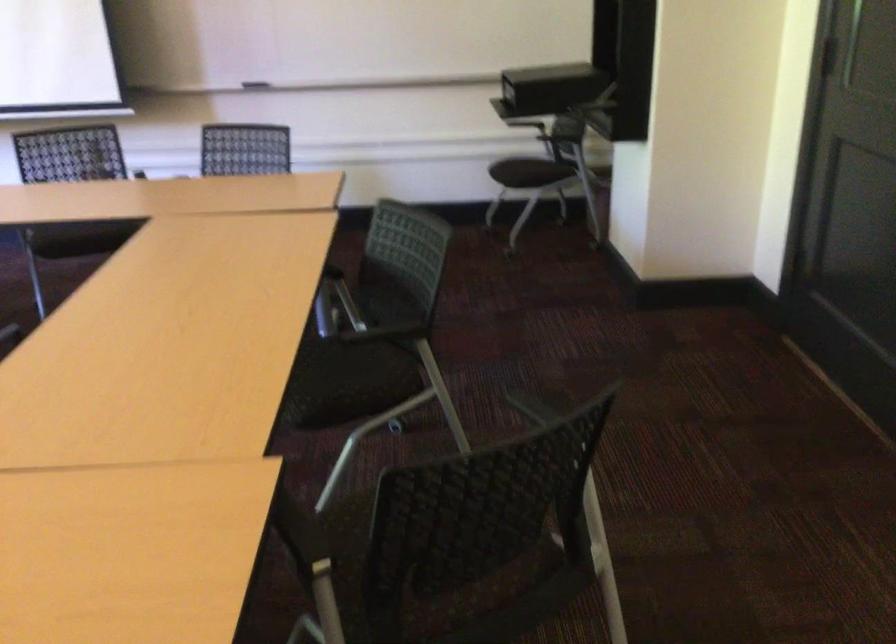
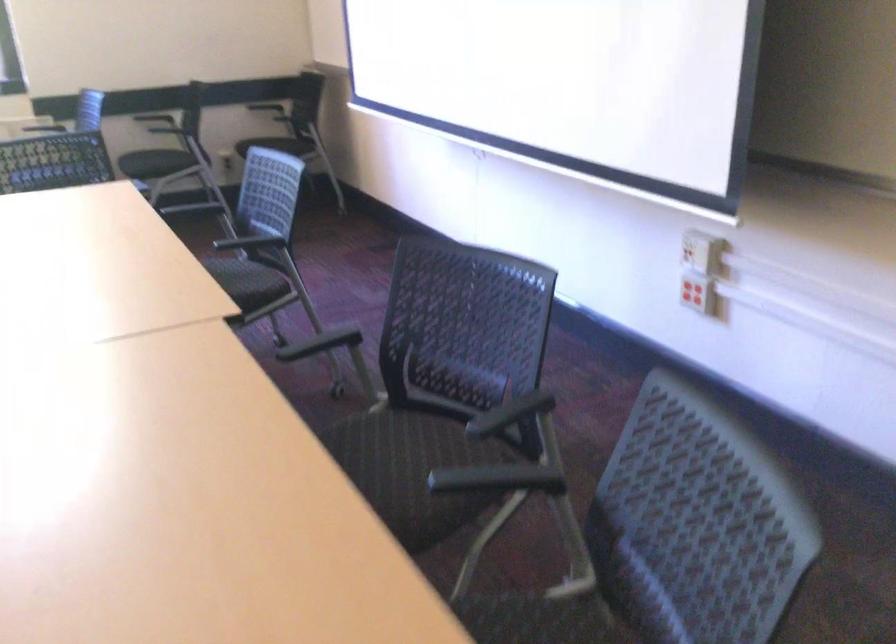
Locate, in the second image, the point that corresponds to point 71,230 in the first image.

(389, 453)